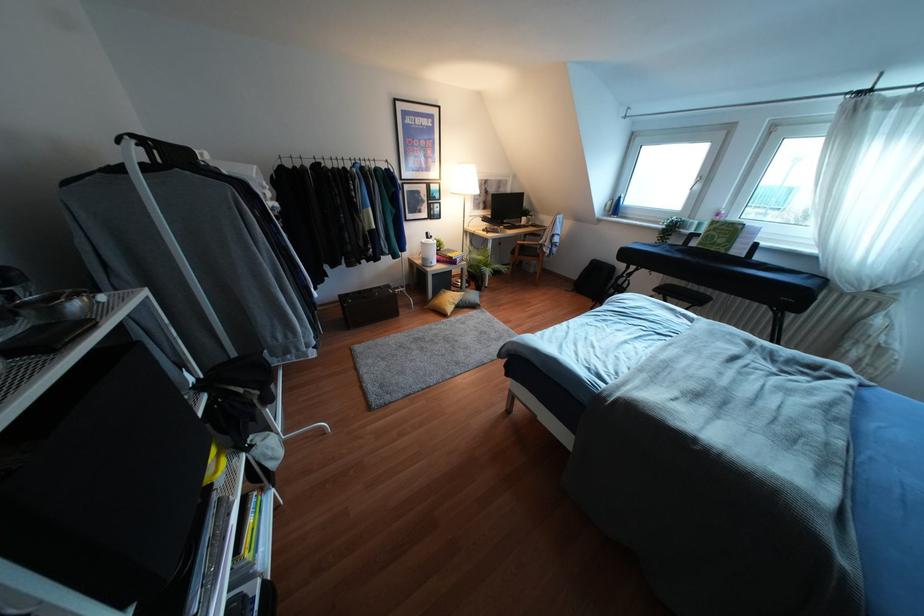
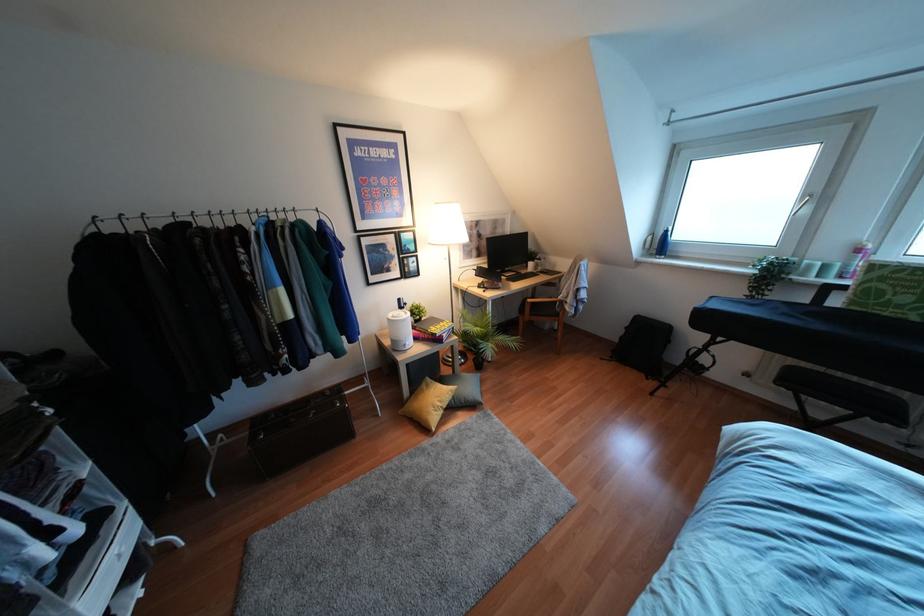
Find the pixel in the second image that matches pixel 482 230 in the first image.

(478, 286)